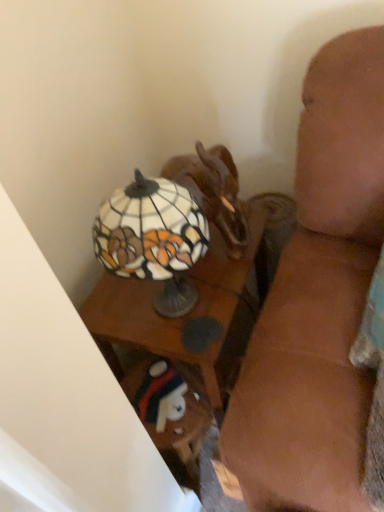
Locate an element on the screen. stained glass lamp at upper center is located at coordinates (188, 313).

Describe the element at coordinates (188, 313) in the screenshot. The image size is (384, 512). I see `stained glass lamp at upper center` at that location.

This screenshot has height=512, width=384. Identify the location of stained glass lamp at upper center. (188, 313).